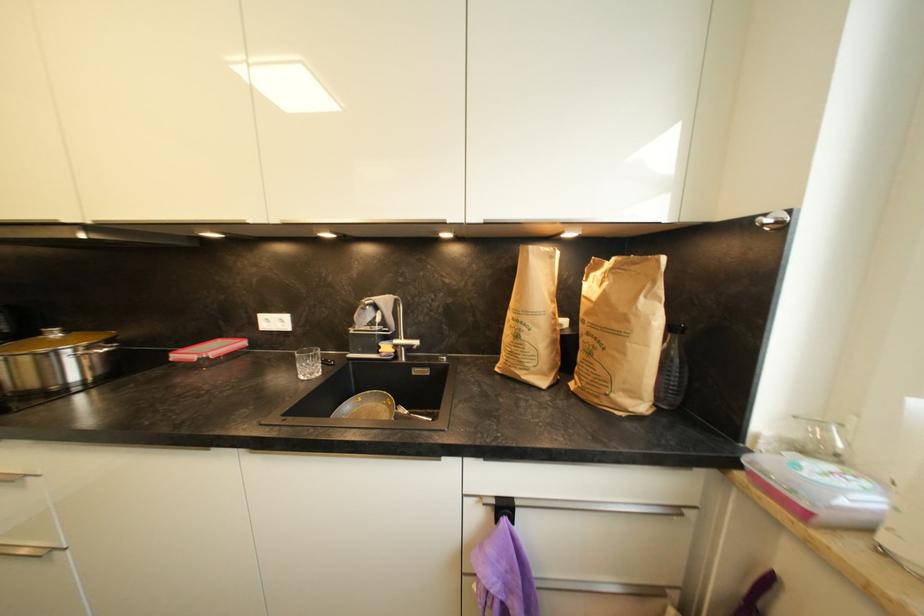
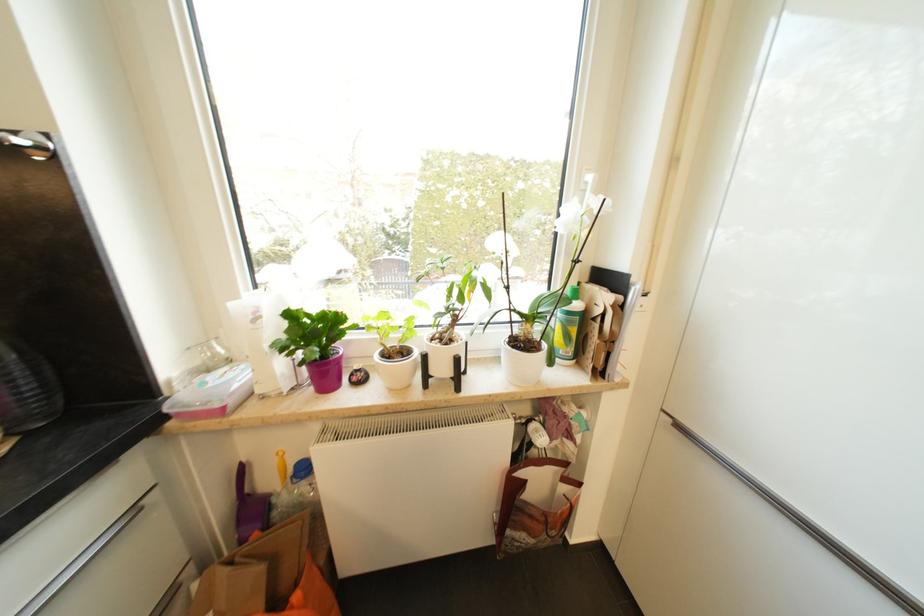
Based on the photo, the images are taken continuously from a first-person perspective. In which direction is your viewpoint rotating?

The rotation direction of the camera is right-down.